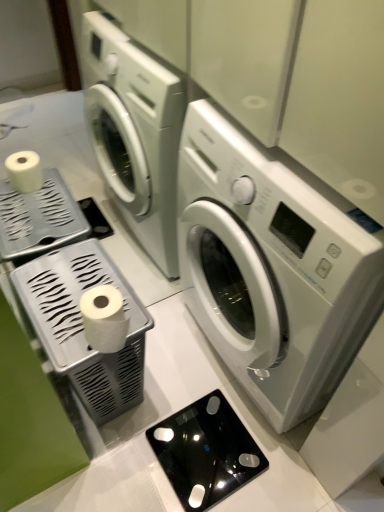
Locate an element on the screen. The height and width of the screenshot is (512, 384). vacant space in between black glass scale at lower center, placed as the 2th appliance when sorted from left to right, and white plastic tissue holder at left, which is the 2th appliance from right to left is located at coordinates (160, 410).